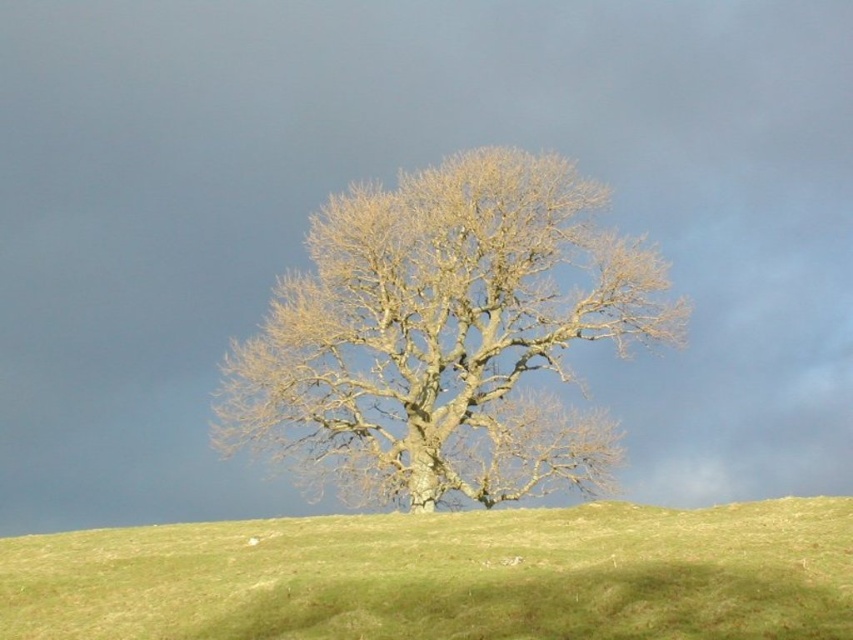
You are a hiker trying to determine which object is shorter between the bare wood tree at center and the green grassy hillside at center. Based on the scene, which one is shorter?

The bare wood tree at center is shorter than the green grassy hillside at center.

Based on the photo, you are a hiker who wants to take a photo of the green grassy hillside at center without the bare wood tree at center blocking the view. Is there a way to position yourself so that the tree is not in the frame?

The bare wood tree at center is positioned over the green grassy hillside at center, so you can move to the side of the tree to take a photo where the tree is not blocking the view of the hillside.

You are standing at the base of the hill and want to take a photo of the bare wood tree at center. If you are currently 100 feet away from the tree, should you move closer or farther away to match the camera distance described?

The bare wood tree at center is 88.90 feet away from the camera. Since you are currently 100 feet away, you should move closer to the tree to reduce the distance to 88.90 feet.